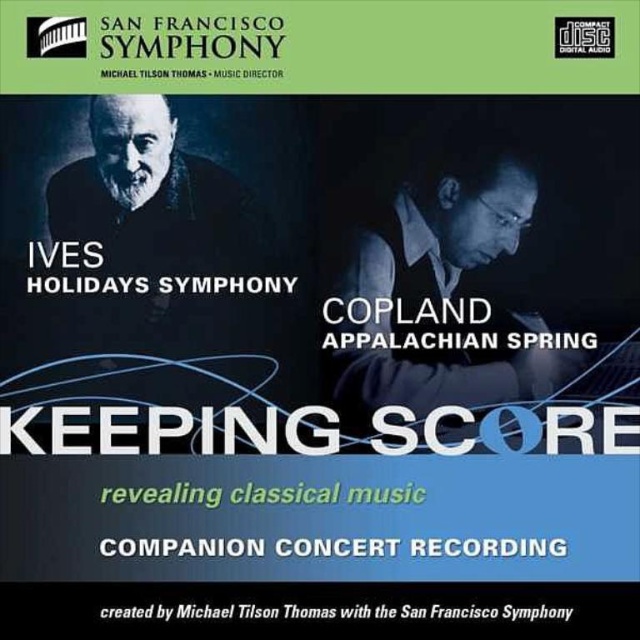
Question: Which of the following is the farthest from the observer?

Choices:
 (A) (40, 280)
 (B) (275, 70)

Answer: (B)

Question: Considering the real-world distances, which object is farthest from the black text at bottom?

Choices:
 (A) white metallic text at center
 (B) black paper at upper center

Answer: (B)

Question: Is matte black vest at upper right above whitetexttitle at center?

Choices:
 (A) no
 (B) yes

Answer: (B)

Question: Can you confirm if whitetextcompanion concert recording at center is wider than black text at bottom?

Choices:
 (A) no
 (B) yes

Answer: (A)

Question: Can you confirm if whitetextcompanion concert recording at center is positioned above green matte text at center?

Choices:
 (A) no
 (B) yes

Answer: (A)

Question: Which is farther from the green matte text at center?

Choices:
 (A) white metallic text at center
 (B) black paper at upper center

Answer: (B)